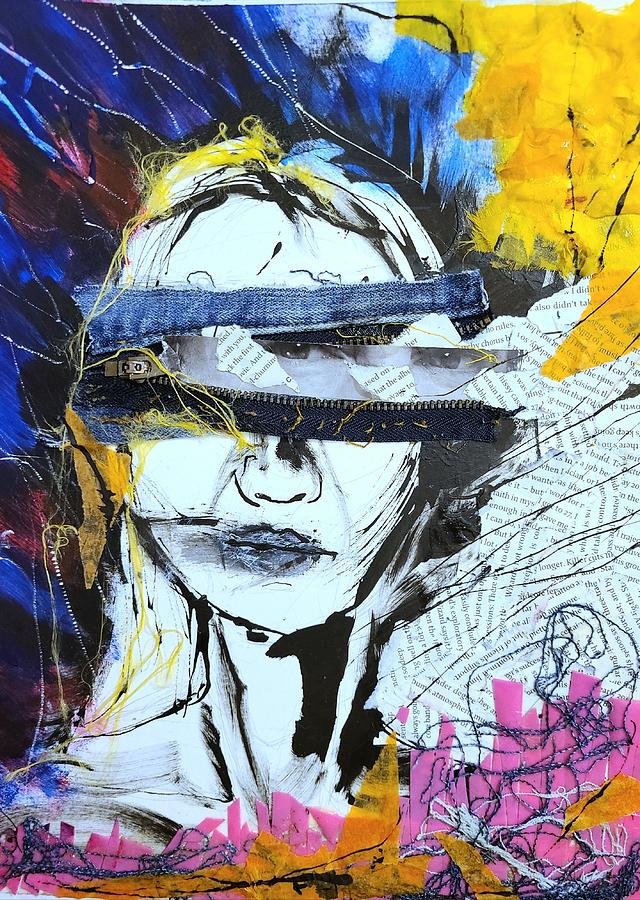
Identify the location of newspaper. (619, 604).